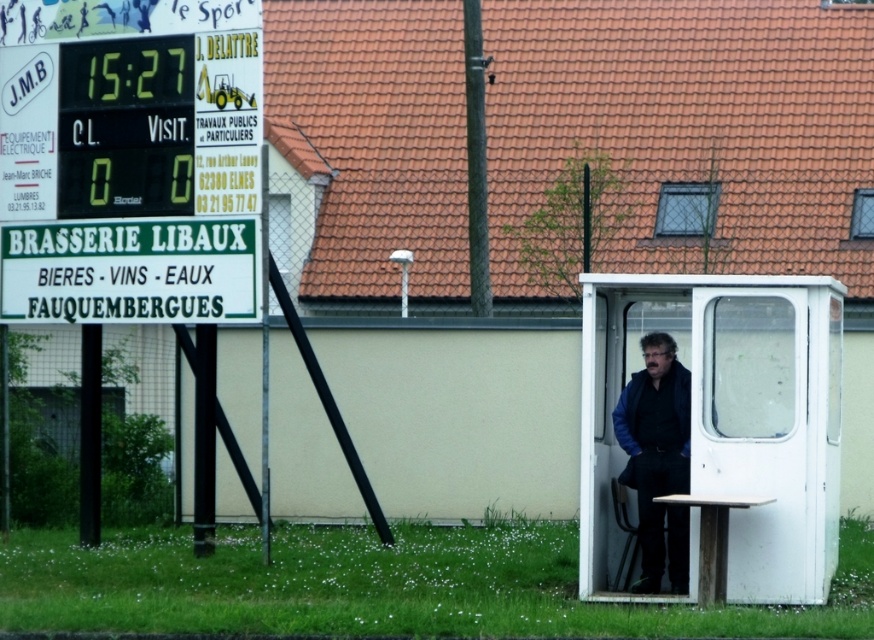
Measure the distance between white plastic booth at center and camera.

36.55 feet

Does point (780, 364) lie in front of point (664, 506)?

Yes, it is.

Who is more forward, (701, 493) or (651, 460)?

Point (701, 493)

Image resolution: width=874 pixels, height=640 pixels. I want to click on white plastic booth at center, so click(x=725, y=419).

Which is above, yellow digital scoreboard at left or dark blue jacket at center?

yellow digital scoreboard at left

Can you confirm if yellow digital scoreboard at left is positioned above dark blue jacket at center?

Yes, yellow digital scoreboard at left is above dark blue jacket at center.

What are the coordinates of `yellow digital scoreboard at left` in the screenshot? It's located at pos(125,128).

Can you confirm if white plastic booth at center is bigger than yellow digital scoreboard at left?

Indeed, white plastic booth at center has a larger size compared to yellow digital scoreboard at left.

Does white plastic booth at center come in front of yellow digital scoreboard at left?

Yes, it is in front of yellow digital scoreboard at left.

Between point (716, 326) and point (137, 115), which one is positioned in front?

Positioned in front is point (716, 326).

Where is `white plastic booth at center`? Image resolution: width=874 pixels, height=640 pixels. white plastic booth at center is located at coordinates (725, 419).